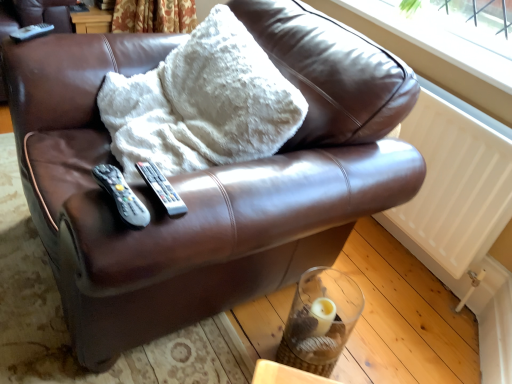
Measure the distance between white matte radiator at lower right and camera.

4.23 feet.

Image resolution: width=512 pixels, height=384 pixels. I want to click on white plastic window frame at upper right, so click(442, 39).

What do you see at coordinates (162, 188) in the screenshot?
I see `white plastic remote at center, arranged as the 2th remote when viewed from the back` at bounding box center [162, 188].

Locate an element on the screen. The image size is (512, 384). white matte radiator at lower right is located at coordinates (455, 196).

Is white matte radiator at lower right facing towards white plastic window frame at upper right?

No, white matte radiator at lower right does not turn towards white plastic window frame at upper right.

Is white matte radiator at lower right positioned before white plastic window frame at upper right?

Yes, it is.

You are a GUI agent. You are given a task and a screenshot of the screen. Output one action in this format:
    pyautogui.click(x=<x>, y=<y>)
    Task: Click on the window frame above the white matte radiator at lower right (from the image's perspective)
    This screenshot has width=512, height=384.
    Given the screenshot: What is the action you would take?
    pyautogui.click(x=442, y=39)

How different are the orientations of white matte radiator at lower right and white plastic window frame at upper right in degrees?

white matte radiator at lower right and white plastic window frame at upper right are facing 1.13 degrees away from each other.

From the image's perspective, is white matte radiator at lower right located above white plastic remote at center, positioned as the third remote in left-to-right order?

Correct, white matte radiator at lower right appears higher than white plastic remote at center, positioned as the third remote in left-to-right order, in the image.

Does white matte radiator at lower right appear on the left side of white plastic remote at center, acting as the second remote starting from the front?

Incorrect, white matte radiator at lower right is not on the left side of white plastic remote at center, acting as the second remote starting from the front.

Locate an element on the screen. Image resolution: width=512 pixels, height=384 pixels. radiator behind the white plastic remote at center, acting as the second remote starting from the front is located at coordinates (455, 196).

Considering the sizes of objects white matte radiator at lower right and white plastic remote at center, which appears as the 2th remote when ordered from the bottom, in the image provided, who is thinner, white matte radiator at lower right or white plastic remote at center, which appears as the 2th remote when ordered from the bottom,?

Thinner between the two is white plastic remote at center, which appears as the 2th remote when ordered from the bottom.

Can you confirm if white plastic window frame at upper right is smaller than white matte remote at upper left, which is counted as the third remote, starting from the front?

Incorrect, white plastic window frame at upper right is not smaller in size than white matte remote at upper left, which is counted as the third remote, starting from the front.

Would you say white plastic window frame at upper right is outside white matte remote at upper left, positioned as the 1th remote in left-to-right order?

Indeed, white plastic window frame at upper right is completely outside white matte remote at upper left, positioned as the 1th remote in left-to-right order.

From a real-world perspective, who is located higher, white plastic window frame at upper right or white matte remote at upper left, positioned as the 1th remote in left-to-right order?

white plastic window frame at upper right is physically above.

Is white plastic window frame at upper right oriented towards white matte remote at upper left, which is counted as the third remote, starting from the front?

Yes, white plastic window frame at upper right is turned towards white matte remote at upper left, which is counted as the third remote, starting from the front.

From the image's perspective, which one is positioned higher, black plastic remote at center, which is the third remote in back-to-front order, or white plastic remote at center, which appears as the 2th remote when ordered from the bottom?

white plastic remote at center, which appears as the 2th remote when ordered from the bottom, from the image's perspective.

Which is behind, black plastic remote at center, marked as the first remote in a bottom-to-top arrangement, or white plastic remote at center, arranged as the 2th remote when viewed from the top?

white plastic remote at center, arranged as the 2th remote when viewed from the top, is further from the camera.

Can you confirm if black plastic remote at center, which ranks as the 2th remote in right-to-left order, is positioned to the right of white plastic remote at center, arranged as the 2th remote when viewed from the back?

No.

Measure the distance between white plastic remote at center, arranged as the 2th remote when viewed from the top, and white matte radiator at lower right.

white plastic remote at center, arranged as the 2th remote when viewed from the top, is 3.50 feet from white matte radiator at lower right.

Is white plastic remote at center, the first remote viewed from the right, next to white matte radiator at lower right and touching it?

No.

Is white plastic remote at center, positioned as the third remote in left-to-right order, inside or outside of white matte radiator at lower right?

white plastic remote at center, positioned as the third remote in left-to-right order, is outside white matte radiator at lower right.

Is white plastic remote at center, the first remote viewed from the right, in front of white matte radiator at lower right?

That is True.

Is point (30, 36) positioned behind point (118, 201)?

Yes, it is.

Choose the correct answer: Is white matte remote at upper left, arranged as the first remote when viewed from the back, inside black plastic remote at center, which is the third remote in back-to-front order, or outside it?

white matte remote at upper left, arranged as the first remote when viewed from the back, exists outside the volume of black plastic remote at center, which is the third remote in back-to-front order.

From the image's perspective, between white matte remote at upper left, positioned as the 1th remote in left-to-right order, and black plastic remote at center, the third remote when ordered from top to bottom, which one is located above?

white matte remote at upper left, positioned as the 1th remote in left-to-right order, appears higher in the image.

Are white matte remote at upper left, the 3th remote in the right-to-left sequence, and black plastic remote at center, marked as the first remote in a bottom-to-top arrangement, making contact?

No, white matte remote at upper left, the 3th remote in the right-to-left sequence, is not touching black plastic remote at center, marked as the first remote in a bottom-to-top arrangement.

From the picture: Is white plastic window frame at upper right facing away from white plastic remote at center, arranged as the 2th remote when viewed from the top?

No, white plastic window frame at upper right is not facing away from white plastic remote at center, arranged as the 2th remote when viewed from the top.

Based on the photo, is white plastic window frame at upper right located outside white plastic remote at center, arranged as the 2th remote when viewed from the back?

Yes.

Considering the sizes of white plastic window frame at upper right and white plastic remote at center, positioned as the third remote in left-to-right order, in the image, is white plastic window frame at upper right taller or shorter than white plastic remote at center, positioned as the third remote in left-to-right order,?

Considering their sizes, white plastic window frame at upper right has more height than white plastic remote at center, positioned as the third remote in left-to-right order.

From a real-world perspective, is white plastic window frame at upper right under white plastic remote at center, arranged as the 2th remote when viewed from the top?

No.

This screenshot has height=384, width=512. What are the coordinates of `window frame behind the white matte radiator at lower right` in the screenshot? It's located at (442, 39).

Identify the location of the 2nd remote located above the white matte radiator at lower right (from a real-world perspective). Image resolution: width=512 pixels, height=384 pixels. (162, 188).

Based on the photo, from the image, which object appears to be farther from white plastic remote at center, arranged as the 2th remote when viewed from the back, white plastic window frame at upper right or white matte radiator at lower right?

The object further to white plastic remote at center, arranged as the 2th remote when viewed from the back, is white plastic window frame at upper right.

Looking at the image, which one is located closer to white matte remote at upper left, the 3th remote in the right-to-left sequence, black plastic remote at center, which is the third remote in back-to-front order, or white matte radiator at lower right?

Among the two, black plastic remote at center, which is the third remote in back-to-front order, is located nearer to white matte remote at upper left, the 3th remote in the right-to-left sequence.

From the image, which object appears to be nearer to black plastic remote at center, which ranks as the 2th remote in right-to-left order, white plastic window frame at upper right or white matte radiator at lower right?

The object closer to black plastic remote at center, which ranks as the 2th remote in right-to-left order, is white matte radiator at lower right.

Based on their spatial positions, is white plastic window frame at upper right or white plastic remote at center, arranged as the 2th remote when viewed from the back, closer to black plastic remote at center, marked as the first remote in a bottom-to-top arrangement?

white plastic remote at center, arranged as the 2th remote when viewed from the back.

Looking at the image, which one is located further to white plastic window frame at upper right, white matte remote at upper left, the 3th remote in the right-to-left sequence, or black plastic remote at center, which ranks as the 2th remote in right-to-left order?

white matte remote at upper left, the 3th remote in the right-to-left sequence.

Estimate the real-world distances between objects in this image. Which object is further from white matte remote at upper left, positioned as the 1th remote in left-to-right order, white matte radiator at lower right or black plastic remote at center, the third remote when ordered from top to bottom?

Based on the image, white matte radiator at lower right appears to be further to white matte remote at upper left, positioned as the 1th remote in left-to-right order.

Based on their spatial positions, is white plastic remote at center, the first remote viewed from the right, or white matte radiator at lower right further from black plastic remote at center, which ranks as the 2th remote in right-to-left order?

white matte radiator at lower right is positioned further to the anchor black plastic remote at center, which ranks as the 2th remote in right-to-left order.

Considering their positions, is white matte radiator at lower right positioned further to black plastic remote at center, the 1th remote when ordered from front to back, than white matte remote at upper left, which is counted as the third remote, starting from the front?

Among the two, white matte radiator at lower right is located further to black plastic remote at center, the 1th remote when ordered from front to back.

What are the coordinates of `remote positioned between black plastic remote at center, marked as the first remote in a bottom-to-top arrangement, and white matte remote at upper left, which is counted as the third remote, starting from the front, from near to far` in the screenshot? It's located at [162, 188].

Where is `window frame between white matte remote at upper left, arranged as the first remote when viewed from the back, and white matte radiator at lower right, in the horizontal direction`? This screenshot has height=384, width=512. window frame between white matte remote at upper left, arranged as the first remote when viewed from the back, and white matte radiator at lower right, in the horizontal direction is located at coordinates (442, 39).

At what (x,y) coordinates should I click in order to perform the action: click on window frame located between black plastic remote at center, marked as the second remote in a left-to-right arrangement, and white matte radiator at lower right in the left-right direction. Please return your answer as a coordinate pair (x, y). This screenshot has height=384, width=512. Looking at the image, I should click on (442, 39).

The image size is (512, 384). Find the location of `remote between black plastic remote at center, marked as the second remote in a left-to-right arrangement, and white matte radiator at lower right, in the horizontal direction`. remote between black plastic remote at center, marked as the second remote in a left-to-right arrangement, and white matte radiator at lower right, in the horizontal direction is located at coordinates (162, 188).